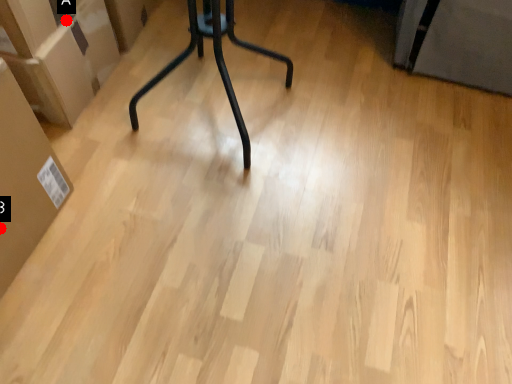
Question: Two points are circled on the image, labeled by A and B beside each circle. Which point is closer to the camera?

Choices:
 (A) A is closer
 (B) B is closer

Answer: (B)